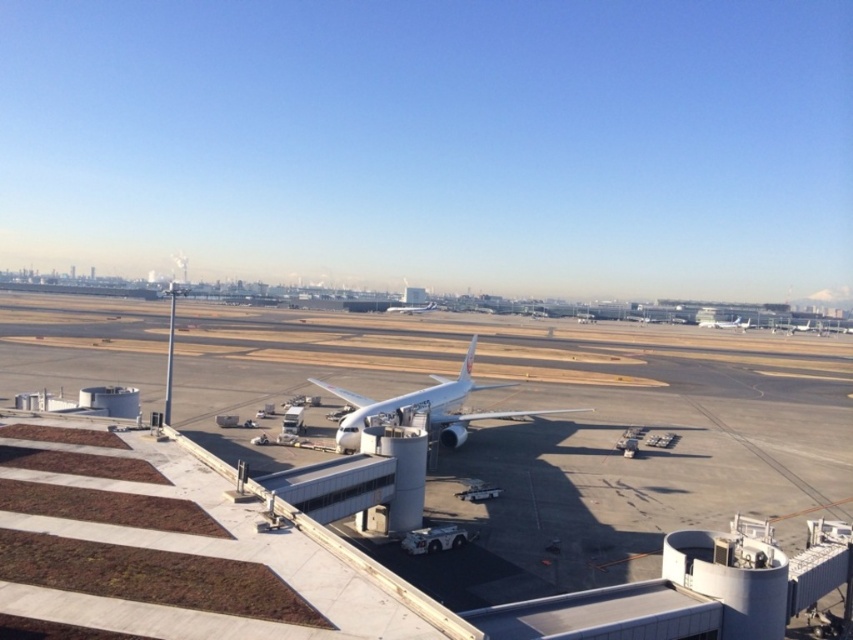
You are standing at the jet bridge of the airplane and want to walk to point A at coordinates point A is point (431, 404) and point B is point (802, 324). Which point is closer to you?

Point A at coordinates point (431, 404) is closer to you because it is in front of point B at coordinates point (802, 324).

You are a pilot who just landed the white matte airplane at right and need to taxi to the gate. The white smooth tarmac at center is your path. Is the tarmac clear of obstacles in front of the airplane?

The white smooth tarmac at center is in front of the white matte airplane at right, so the path is clear of obstacles as the tarmac is smooth and there are no objects mentioned blocking the way.